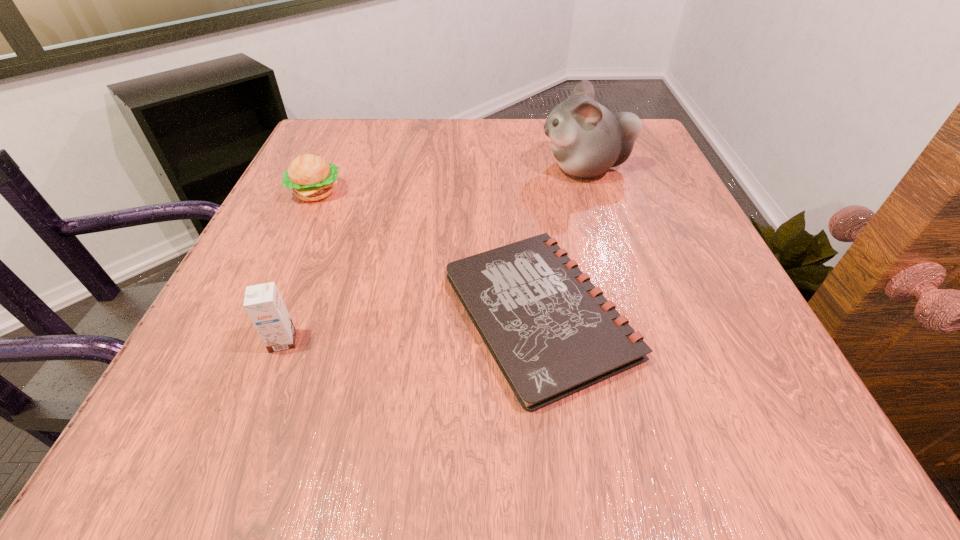
I want to click on hamster, so click(x=587, y=140).

At what (x,y) coordinates should I click in order to perform the action: click on chocolate milk. Please return your answer as a coordinate pair (x, y). The height and width of the screenshot is (540, 960). Looking at the image, I should click on (263, 303).

You are a GUI agent. You are given a task and a screenshot of the screen. Output one action in this format:
    pyautogui.click(x=<x>, y=<y>)
    Task: Click on the second shortest object
    This screenshot has height=540, width=960.
    Given the screenshot: What is the action you would take?
    pyautogui.click(x=311, y=178)

This screenshot has height=540, width=960. I want to click on the shortest object, so click(552, 333).

At what (x,y) coordinates should I click in order to perform the action: click on vacant space located 0.280m on the face of the tallest object. Please return your answer as a coordinate pair (x, y). Looking at the image, I should click on (414, 168).

In order to click on vacant point located 0.330m on the face of the tallest object in this screenshot , I will do `click(392, 168)`.

Locate an element on the screen. blank area located 0.210m on the face of the tallest object is located at coordinates (445, 168).

Where is `vacant space located on the right of the chocolate milk`? vacant space located on the right of the chocolate milk is located at coordinates (454, 341).

Identify the location of vacant space located 0.270m on the front of the third tallest object. The width and height of the screenshot is (960, 540). click(262, 309).

This screenshot has width=960, height=540. Identify the location of vacant space situated 0.350m on the left of the notebook. (219, 313).